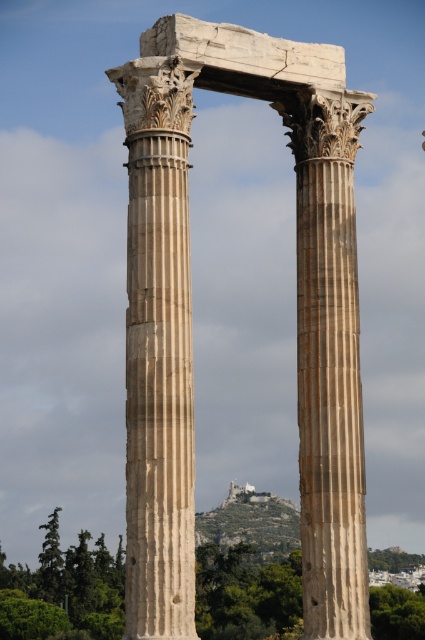
You are standing in front of the Temple of Olympian Zeus ruins. There is a point marked at coordinates (x=190, y=317). What does this point correspond to in the scene?

The point corresponds to the beige stone columns at center.